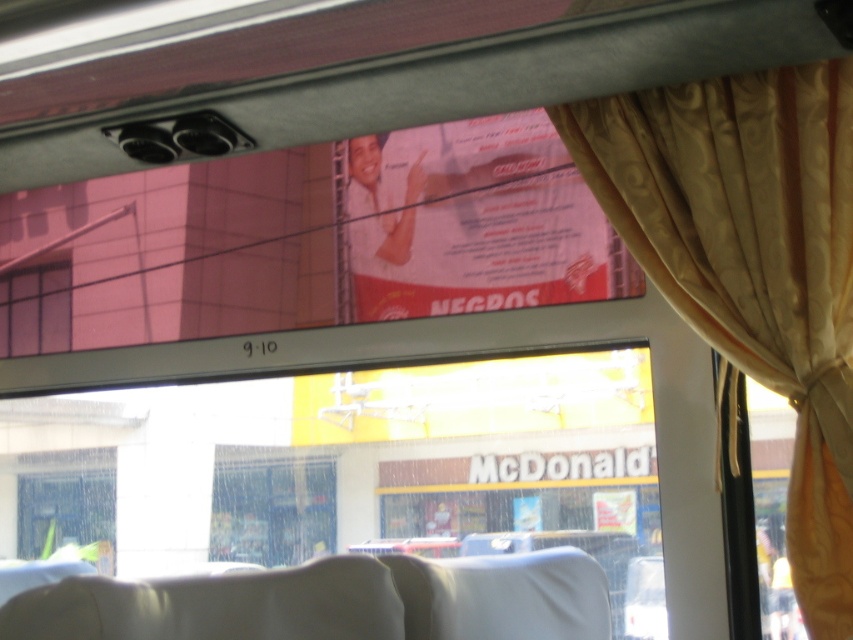
Question: Can you confirm if red glossy poster at upper center is bigger than pink glass window at upper left?

Choices:
 (A) yes
 (B) no

Answer: (A)

Question: Can you confirm if gold satin curtain at right is positioned to the left of red glossy poster at upper center?

Choices:
 (A) yes
 (B) no

Answer: (B)

Question: Considering the relative positions of red glossy poster at upper center and pink glass window at upper left in the image provided, where is red glossy poster at upper center located with respect to pink glass window at upper left?

Choices:
 (A) left
 (B) right

Answer: (B)

Question: Which of the following is the closest to the observer?

Choices:
 (A) gold satin curtain at right
 (B) pink glass window at upper left

Answer: (A)

Question: Estimate the real-world distances between objects in this image. Which object is closer to the red glossy poster at upper center?

Choices:
 (A) gold satin curtain at right
 (B) pink glass window at upper left

Answer: (A)

Question: Which point appears closest to the camera in this image?

Choices:
 (A) (68, 301)
 (B) (795, 116)
 (C) (491, 252)

Answer: (B)